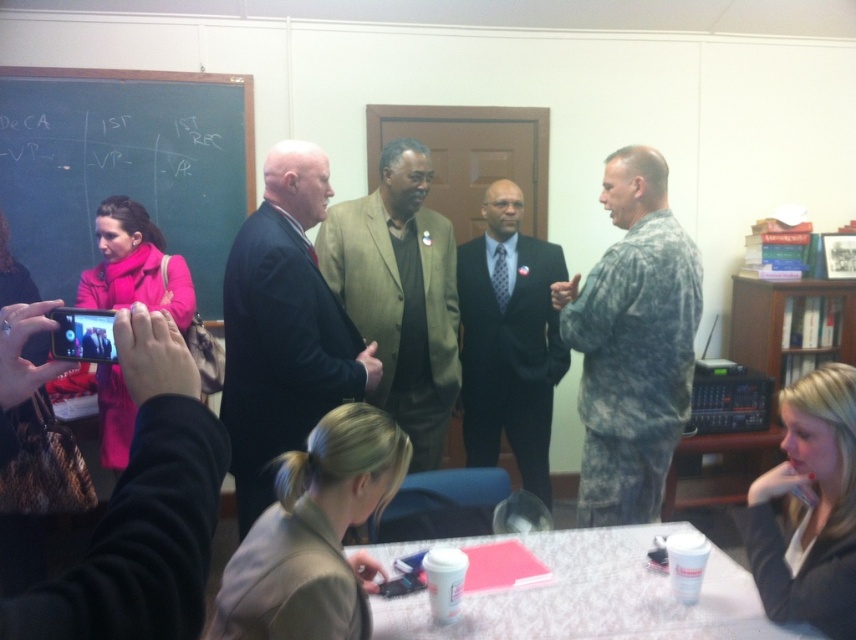
Question: Where is green chalkboard at upper left located in relation to black suit at center in the image?

Choices:
 (A) left
 (B) right

Answer: (A)

Question: Is camouflage uniform at right to the left of dark suit at center from the viewer's perspective?

Choices:
 (A) yes
 (B) no

Answer: (B)

Question: Which of these objects is positioned closest to the black suit at center?

Choices:
 (A) blonde hair at lower right
 (B) camouflage uniform at right

Answer: (B)

Question: Which object appears farthest from the camera in this image?

Choices:
 (A) dark suit at center
 (B) light brown suit at center

Answer: (B)

Question: Can you confirm if blonde hair at lower right is positioned to the left of pink matte coat at left?

Choices:
 (A) yes
 (B) no

Answer: (B)

Question: Among these points, which one is farthest from the camera?

Choices:
 (A) click(749, 529)
 (B) click(569, 292)

Answer: (B)